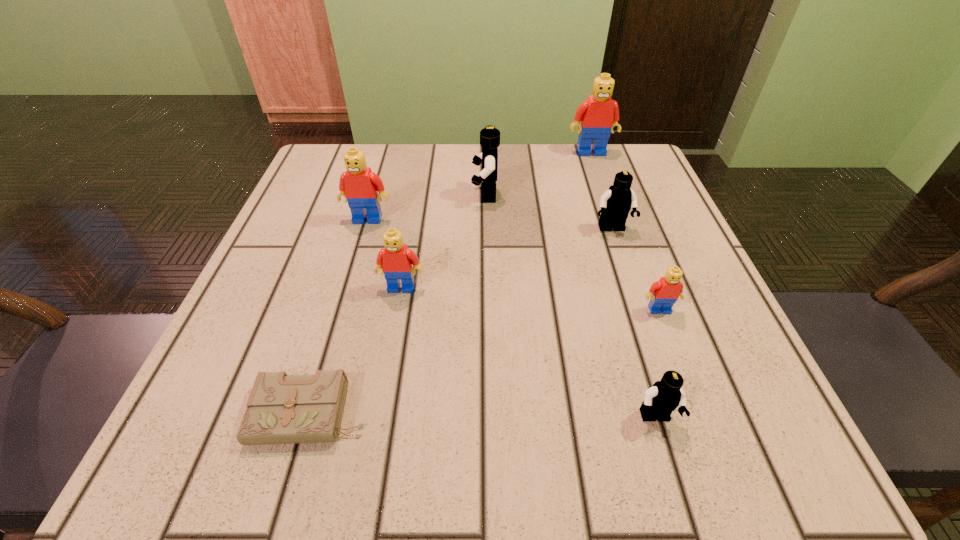
The width and height of the screenshot is (960, 540). What are the coordinates of `vacant point located between the second biggest black Lego and the shortest object` in the screenshot? It's located at (462, 322).

The height and width of the screenshot is (540, 960). I want to click on empty space that is in between the leftmost black Lego and the sixth farthest object, so click(x=572, y=252).

Where is `vacant space that's between the second farthest black Lego and the fourth nearest object`? The image size is (960, 540). vacant space that's between the second farthest black Lego and the fourth nearest object is located at coordinates (507, 258).

At what (x,y) coordinates should I click in order to perform the action: click on vacant space that's between the third smallest red Lego and the second smallest black Lego. Please return your answer as a coordinate pair (x, y). Image resolution: width=960 pixels, height=540 pixels. Looking at the image, I should click on (490, 224).

Identify the location of unoccupied position between the biggest black Lego and the diary. (398, 304).

This screenshot has height=540, width=960. Identify the location of empty location between the farthest red Lego and the fourth nearest object. (496, 220).

Where is `free space between the farthest red Lego and the leftmost red Lego`? free space between the farthest red Lego and the leftmost red Lego is located at coordinates (479, 185).

Locate which object is the fifth closest to the third nearest object. Please provide its 2D coordinates. Your answer should be formatted as a tuple, i.e. [(x, y)], where the tuple contains the x and y coordinates of a point satisfying the conditions above.

[(281, 409)]

Identify the location of object that stands as the seventh closest to the tallest Lego. (281, 409).

Select which Lego appears as the fifth closest to the second biggest red Lego. Please provide its 2D coordinates. Your answer should be formatted as a tuple, i.e. [(x, y)], where the tuple contains the x and y coordinates of a point satisfying the conditions above.

[(664, 293)]